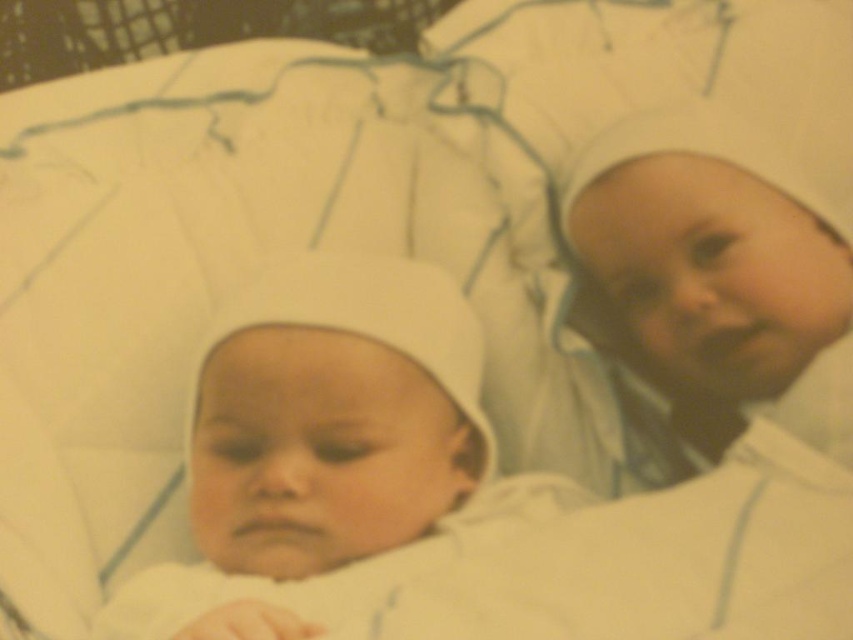
You are a nurse in a hospital nursery and need to check on the white soft fabric newborn at lower left and the white soft fabric newborn at right. Which baby should you check first if you want to reach the one closer to you first?

You should check the white soft fabric newborn at lower left first because it is in front of the white soft fabric newborn at right, making it closer to you.

In the scene shown: You are a nurse in a hospital nursery. You see a white soft fabric newborn at lower left represented by point (x=329, y=452). Where is the newborn located in the image?

The white soft fabric newborn at lower left is located at point (x=329, y=452) in the image.